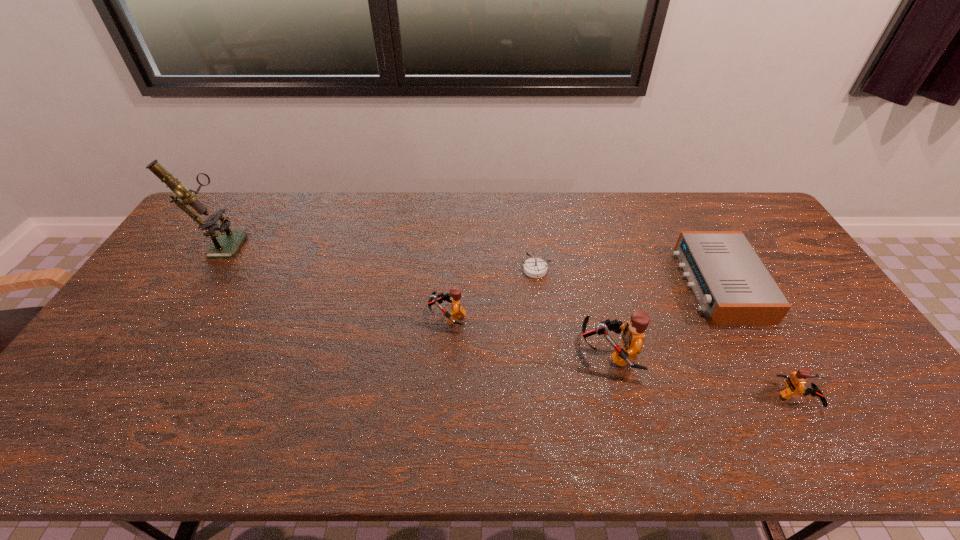
Locate an element on the screen. vacant space at the far right corner of the desktop is located at coordinates tap(746, 199).

At what (x,y) coordinates should I click in order to perform the action: click on free area in between the fourth shortest object and the compass. Please return your answer as a coordinate pair (x, y). Looking at the image, I should click on (492, 293).

This screenshot has width=960, height=540. Find the location of `vacant space that's between the fifth object from right to left and the tallest object`. vacant space that's between the fifth object from right to left and the tallest object is located at coordinates (333, 280).

What are the coordinates of `empty location between the shortest Lego and the radio receiver` in the screenshot? It's located at pyautogui.click(x=758, y=341).

Where is `free space between the compass and the third shortest object`? free space between the compass and the third shortest object is located at coordinates (666, 333).

The width and height of the screenshot is (960, 540). I want to click on free space between the second Lego from left to right and the second tallest Lego, so click(x=528, y=335).

Identify the location of vacant area that lies between the radio receiver and the tallest object. (469, 264).

Where is `unoccupied area between the shortest object and the microscope`? unoccupied area between the shortest object and the microscope is located at coordinates (377, 256).

This screenshot has height=540, width=960. Identify the location of vacant point located between the fourth shortest object and the second shortest object. (583, 300).

I want to click on unoccupied position between the radio receiver and the second object from left to right, so point(583,300).